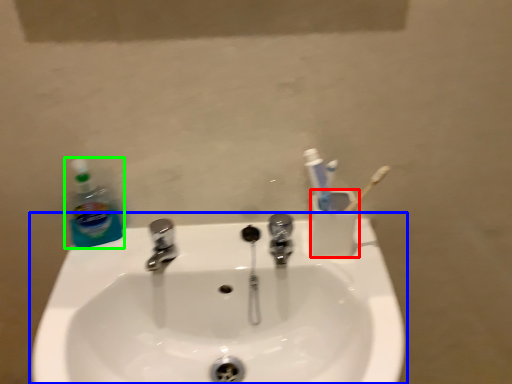
Question: Which is nearer to the liquid (highlighted by a red box)? sink (highlighted by a blue box) or cleaning product (highlighted by a green box).

Choices:
 (A) sink
 (B) cleaning product

Answer: (A)